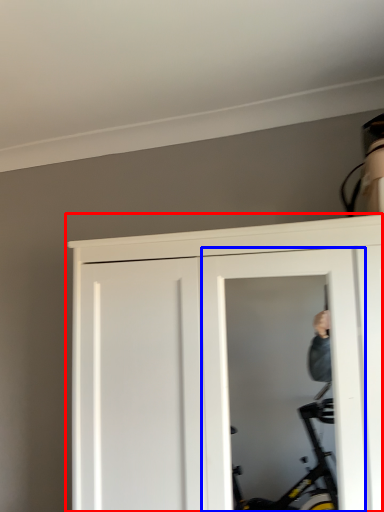
Question: Among these objects, which one is nearest to the camera, door (highlighted by a red box) or screen door (highlighted by a blue box)?

Choices:
 (A) door
 (B) screen door

Answer: (A)